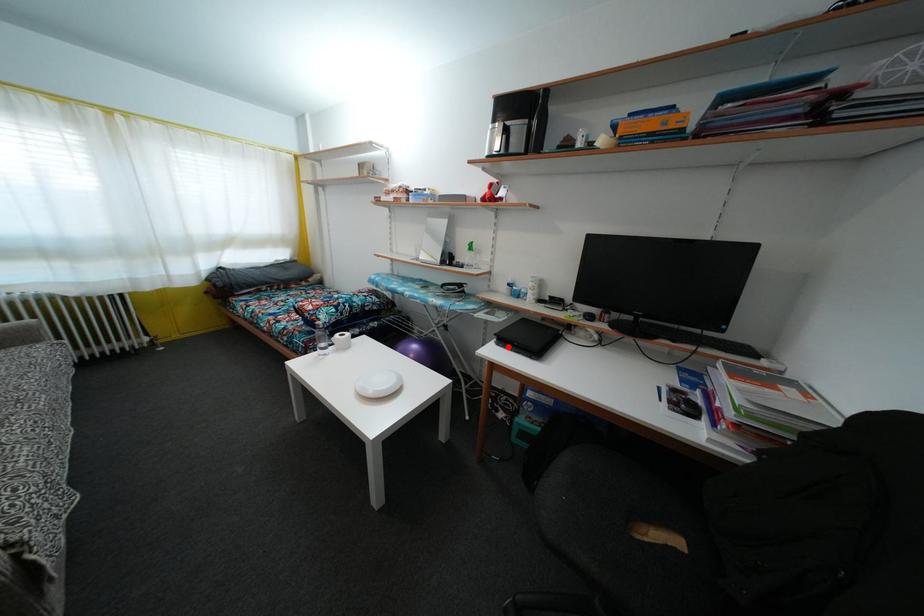
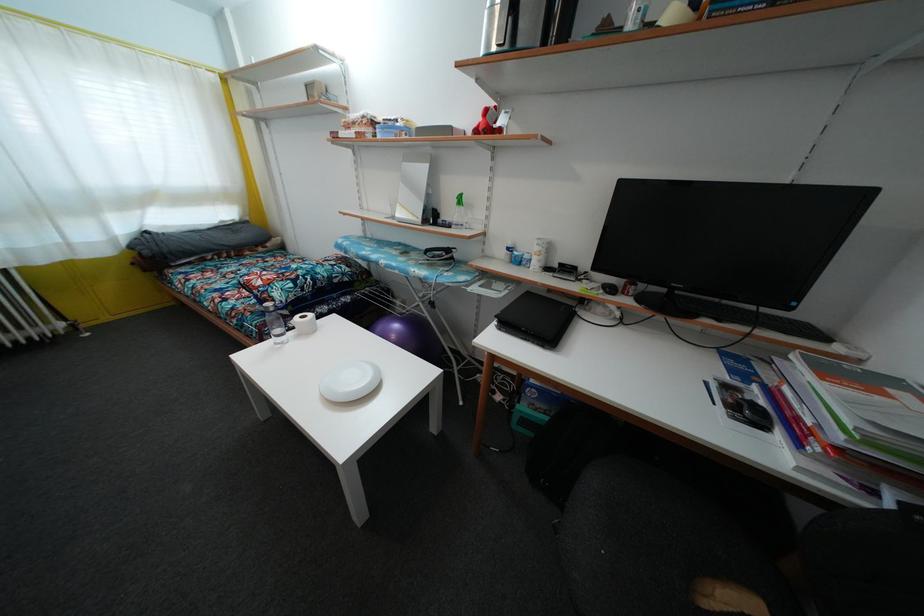
Where in the second image is the point corresponding to the highlighted location from the first image?

(512, 331)